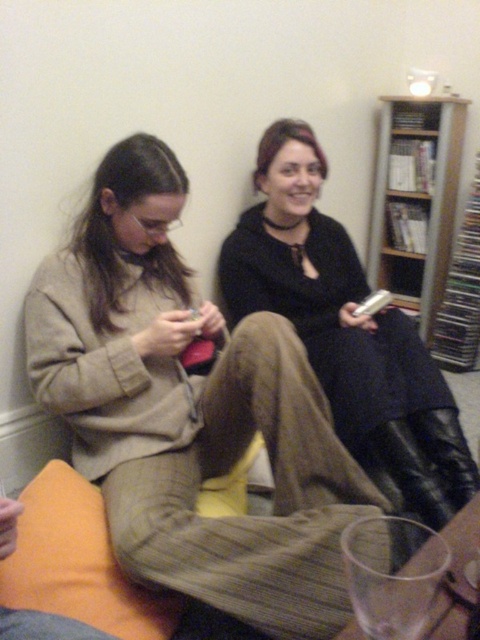
Question: Estimate the real-world distances between objects in this image. Which object is closer to the matte black phone at center?

Choices:
 (A) beige woolen sweater at center
 (B) wooden bookshelf at upper right

Answer: (A)

Question: Which object appears closest to the camera in this image?

Choices:
 (A) orange fabric pillow at lower left
 (B) wooden bookshelf at upper right
 (C) matte black phone at center

Answer: (A)

Question: Considering the relative positions of beige woolen sweater at center and wooden bookshelf at upper right in the image provided, where is beige woolen sweater at center located with respect to wooden bookshelf at upper right?

Choices:
 (A) left
 (B) right

Answer: (A)

Question: Among these points, which one is nearest to the camera?

Choices:
 (A) (307, 170)
 (B) (262, 320)
 (C) (24, 605)

Answer: (C)

Question: Is orange fabric pillow at lower left bigger than wooden bookshelf at upper right?

Choices:
 (A) yes
 (B) no

Answer: (B)

Question: Is orange fabric pillow at lower left wider than wooden bookshelf at upper right?

Choices:
 (A) yes
 (B) no

Answer: (B)